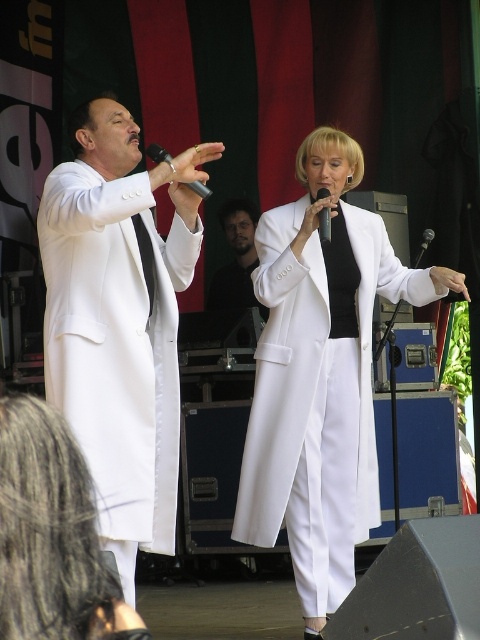
You are standing in the audience facing the stage. The stage has a man on the left and a woman on the right. There is a point marked at coordinates (120, 321). Which object on the stage does this point correspond to?

The point at coordinates (120, 321) corresponds to the matte white coat at left.

You are a stagehand who needs to place a new microphone stand at the same position as the black matte microphone at upper center currently located at point (157, 154). What coordinates should you use?

The black matte microphone at upper center is located at point (157, 154), so you should place the new microphone stand at those coordinates.